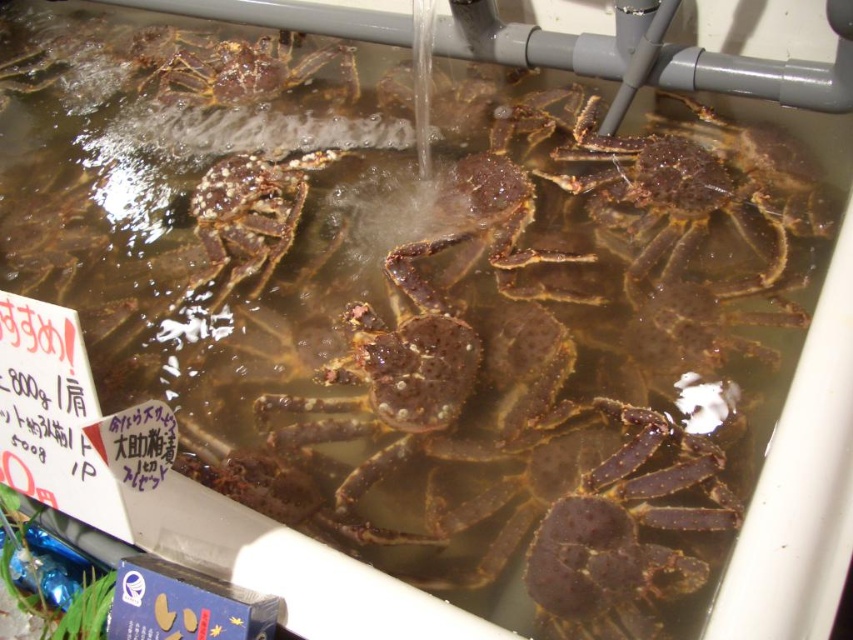
Is speckled brown crab at center above brown rough crab at upper center?

No, speckled brown crab at center is not above brown rough crab at upper center.

The image size is (853, 640). I want to click on speckled brown crab at center, so click(x=248, y=216).

The height and width of the screenshot is (640, 853). I want to click on speckled brown crab at center, so click(248, 216).